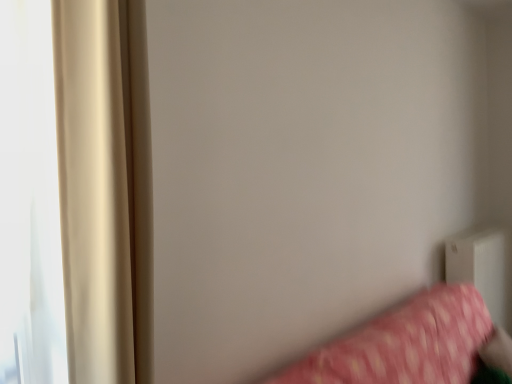
Question: Should I look upward or downward to see white plastic radiator at lower right?

Choices:
 (A) up
 (B) down

Answer: (B)

Question: Would you say beige satin curtain at left is a long distance from pink fabric bed at lower right?

Choices:
 (A) no
 (B) yes

Answer: (B)

Question: Is beige satin curtain at left completely or partially outside of pink fabric bed at lower right?

Choices:
 (A) yes
 (B) no

Answer: (A)

Question: Is beige satin curtain at left facing towards pink fabric bed at lower right?

Choices:
 (A) yes
 (B) no

Answer: (B)

Question: Is beige satin curtain at left shorter than pink fabric bed at lower right?

Choices:
 (A) no
 (B) yes

Answer: (A)

Question: Can you confirm if beige satin curtain at left is positioned to the right of pink fabric bed at lower right?

Choices:
 (A) no
 (B) yes

Answer: (A)

Question: From the image's perspective, is beige satin curtain at left beneath pink fabric bed at lower right?

Choices:
 (A) no
 (B) yes

Answer: (A)

Question: Can we say white plastic radiator at lower right lies outside pink fabric bed at lower right?

Choices:
 (A) no
 (B) yes

Answer: (B)

Question: Does white plastic radiator at lower right touch pink fabric bed at lower right?

Choices:
 (A) yes
 (B) no

Answer: (B)

Question: Considering the relative sizes of white plastic radiator at lower right and pink fabric bed at lower right in the image provided, is white plastic radiator at lower right bigger than pink fabric bed at lower right?

Choices:
 (A) no
 (B) yes

Answer: (A)

Question: Is white plastic radiator at lower right aimed at pink fabric bed at lower right?

Choices:
 (A) no
 (B) yes

Answer: (A)

Question: Considering the relative sizes of white plastic radiator at lower right and pink fabric bed at lower right in the image provided, is white plastic radiator at lower right thinner than pink fabric bed at lower right?

Choices:
 (A) no
 (B) yes

Answer: (B)

Question: Can you confirm if white plastic radiator at lower right is smaller than pink fabric bed at lower right?

Choices:
 (A) no
 (B) yes

Answer: (B)

Question: Considering the relative positions of pink fabric bed at lower right and beige satin curtain at left in the image provided, is pink fabric bed at lower right to the right of beige satin curtain at left from the viewer's perspective?

Choices:
 (A) no
 (B) yes

Answer: (B)